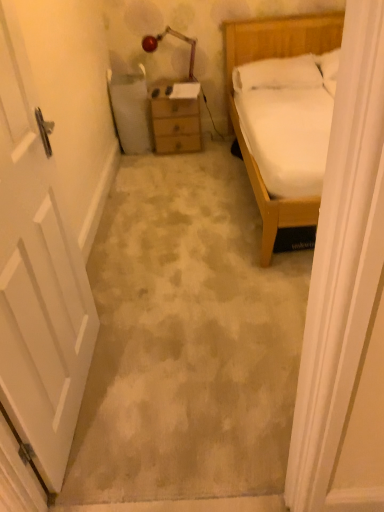
Question: From the image's perspective, is white matte door at left over metallic red lamp at upper center?

Choices:
 (A) no
 (B) yes

Answer: (A)

Question: From a real-world perspective, is white matte door at left physically above metallic red lamp at upper center?

Choices:
 (A) yes
 (B) no

Answer: (B)

Question: Is white matte door at left shorter than metallic red lamp at upper center?

Choices:
 (A) yes
 (B) no

Answer: (B)

Question: Is white matte door at left closer to the viewer compared to metallic red lamp at upper center?

Choices:
 (A) no
 (B) yes

Answer: (B)

Question: Considering the relative sizes of white matte door at left and metallic red lamp at upper center in the image provided, is white matte door at left smaller than metallic red lamp at upper center?

Choices:
 (A) yes
 (B) no

Answer: (B)

Question: Is white matte door at left not close to metallic red lamp at upper center?

Choices:
 (A) yes
 (B) no

Answer: (A)

Question: Considering the relative sizes of white soft pillow at upper right and wooden chest of drawers at center in the image provided, is white soft pillow at upper right bigger than wooden chest of drawers at center?

Choices:
 (A) no
 (B) yes

Answer: (A)

Question: Is white soft pillow at upper right positioned behind wooden chest of drawers at center?

Choices:
 (A) no
 (B) yes

Answer: (A)

Question: Can we say white soft pillow at upper right lies outside wooden chest of drawers at center?

Choices:
 (A) no
 (B) yes

Answer: (B)

Question: From a real-world perspective, is white soft pillow at upper right on wooden chest of drawers at center?

Choices:
 (A) no
 (B) yes

Answer: (B)

Question: Can you confirm if white soft pillow at upper right is thinner than wooden chest of drawers at center?

Choices:
 (A) no
 (B) yes

Answer: (A)

Question: Is the position of white soft pillow at upper right less distant than that of wooden chest of drawers at center?

Choices:
 (A) no
 (B) yes

Answer: (B)

Question: From a real-world perspective, is metallic red lamp at upper center on top of wooden chest of drawers at center?

Choices:
 (A) no
 (B) yes

Answer: (B)